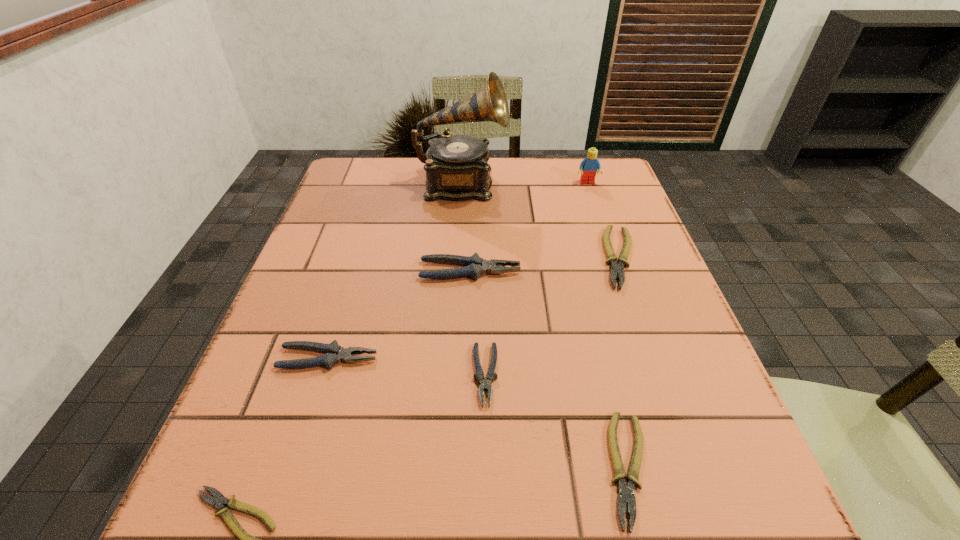
Image resolution: width=960 pixels, height=540 pixels. In order to click on the tallest object in this screenshot , I will do [x=456, y=166].

Locate an element on the screen. blue Lego is located at coordinates (588, 167).

At what (x,y) coordinates should I click in order to perform the action: click on Lego. Please return your answer as a coordinate pair (x, y). Looking at the image, I should click on (588, 167).

Where is `the sixth shortest object`? the sixth shortest object is located at coordinates (476, 266).

At what (x,y) coordinates should I click in order to perform the action: click on the tallest pliers. Please return your answer as a coordinate pair (x, y). The height and width of the screenshot is (540, 960). Looking at the image, I should click on (476, 266).

Locate an element on the screen. The height and width of the screenshot is (540, 960). the second biggest gray pliers is located at coordinates (334, 353).

This screenshot has height=540, width=960. Find the location of `the fifth shortest object`. the fifth shortest object is located at coordinates (334, 353).

Where is `the farthest yellow pliers`? the farthest yellow pliers is located at coordinates (616, 269).

Identify the location of the rightmost pliers. The height and width of the screenshot is (540, 960). (616, 269).

This screenshot has width=960, height=540. In order to click on the smallest gray pliers in this screenshot , I will do `click(486, 383)`.